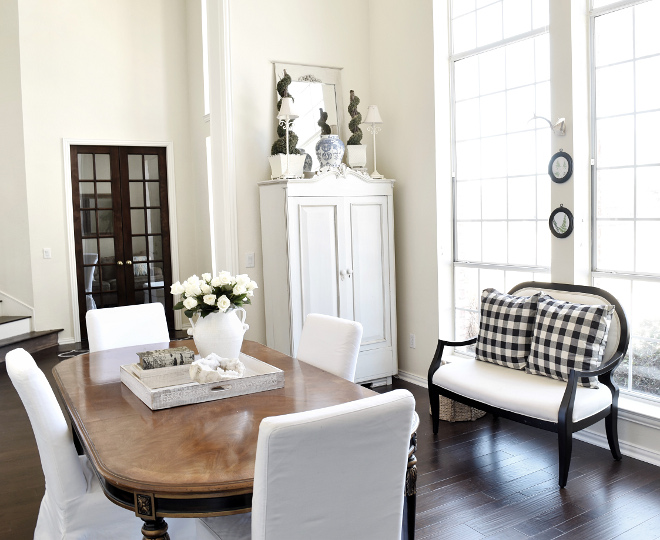
Where is `dining table`? The height and width of the screenshot is (540, 660). dining table is located at coordinates (249, 416).